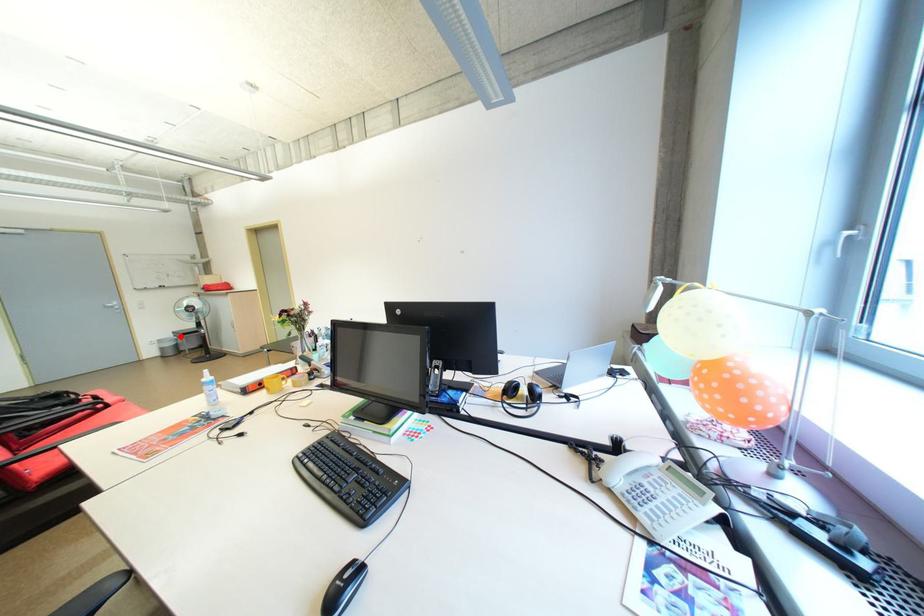
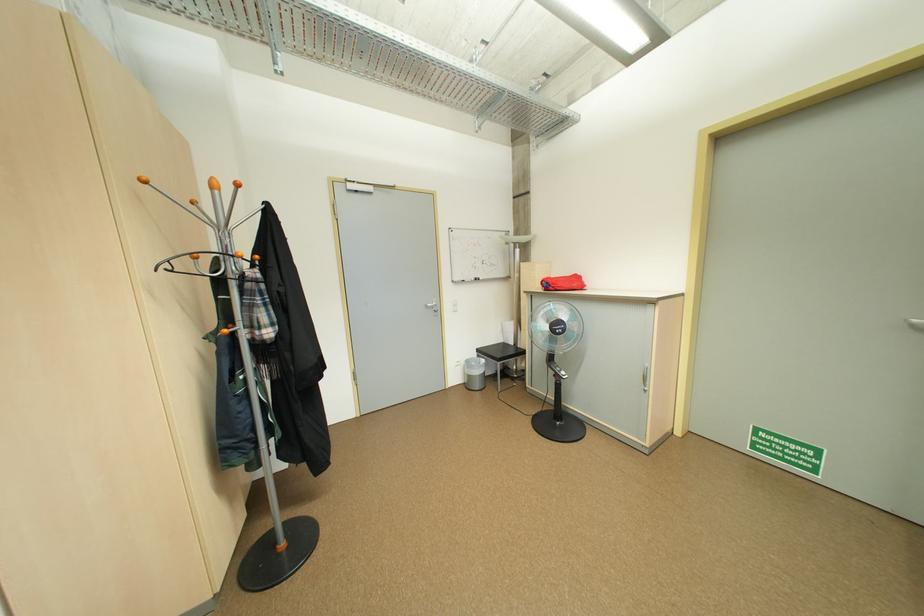
Question: I am providing you with two images of the same scene from different viewpoints. Image1 has a red point marked. In image2, the corresponding 3D location appears at what relative position? Reply with the corresponding letter.

Choices:
 (A) Closer
 (B) Farther

Answer: (B)